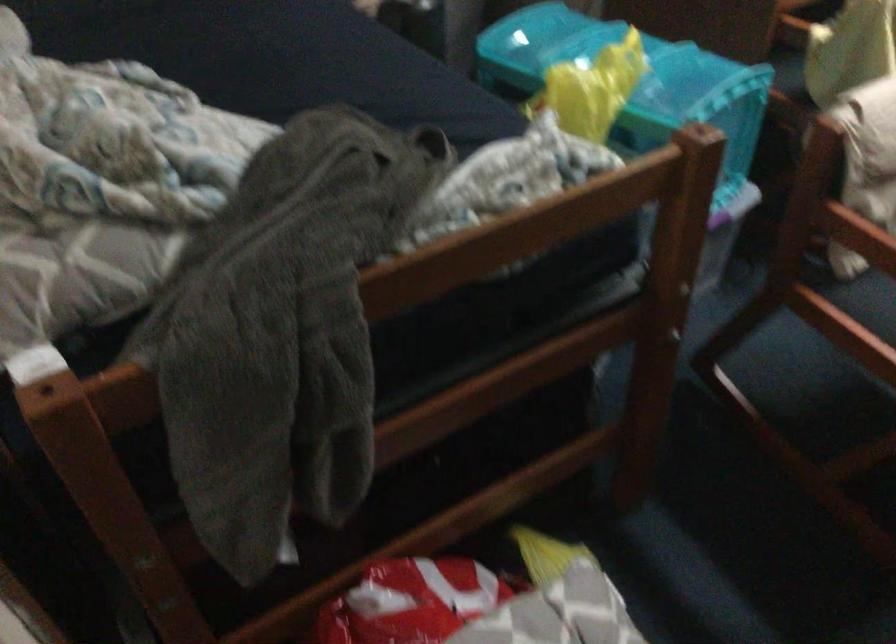
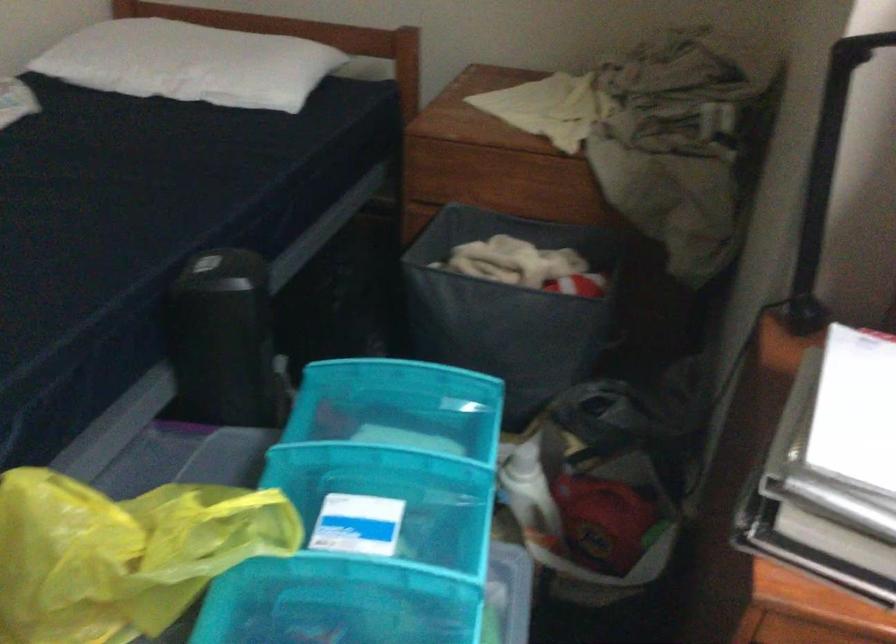
In the second image, find the point that corresponds to pixel 597 100 in the first image.

(122, 554)